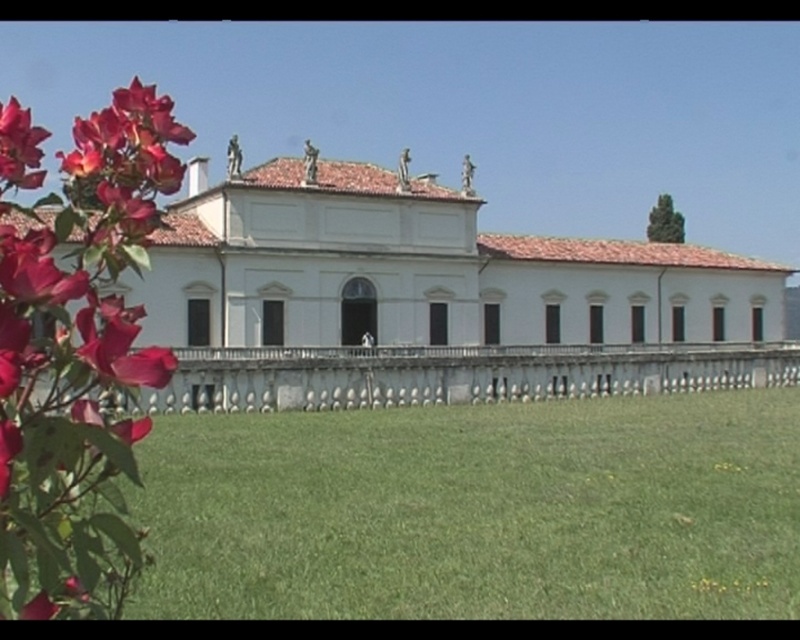
Question: Which is farther from the matte red petals at left?

Choices:
 (A) white smooth palace at center
 (B) white stone fence at center

Answer: (A)

Question: Which point is closer to the camera?

Choices:
 (A) (68, 547)
 (B) (712, 355)

Answer: (A)

Question: Which of the following is the closest to the observer?

Choices:
 (A) white stone fence at center
 (B) matte red petals at left
 (C) white smooth palace at center

Answer: (B)

Question: Does matte red petals at left have a larger size compared to white stone fence at center?

Choices:
 (A) yes
 (B) no

Answer: (B)

Question: Does white smooth palace at center have a smaller size compared to matte red petals at left?

Choices:
 (A) no
 (B) yes

Answer: (A)

Question: Can you confirm if white smooth palace at center is smaller than white stone fence at center?

Choices:
 (A) yes
 (B) no

Answer: (B)